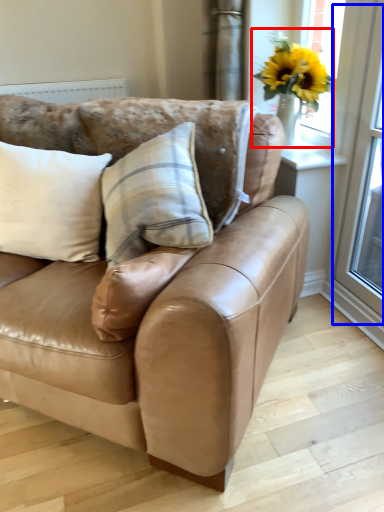
Question: Which point is further to the camera, floral arrangement (highlighted by a red box) or screen door (highlighted by a blue box)?

Choices:
 (A) floral arrangement
 (B) screen door

Answer: (A)